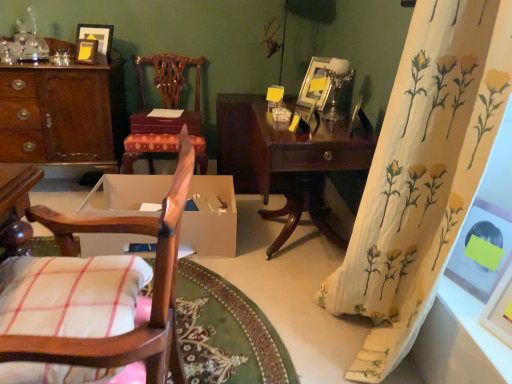
Locate an element on the screen. The image size is (512, 384). vacant area situated below white floral fabric curtain at right (from a real-world perspective) is located at coordinates (353, 342).